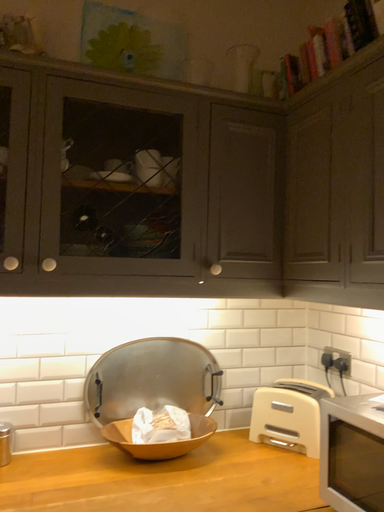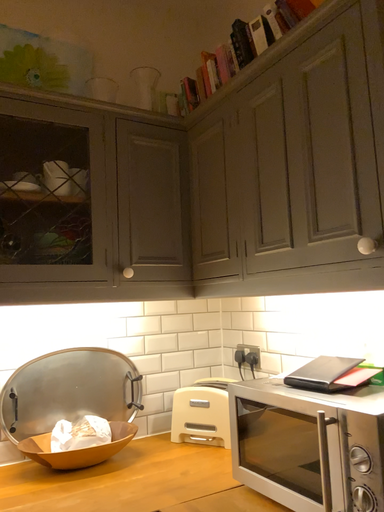
Question: Which way did the camera rotate in the video?

Choices:
 (A) rotated right
 (B) rotated left

Answer: (A)